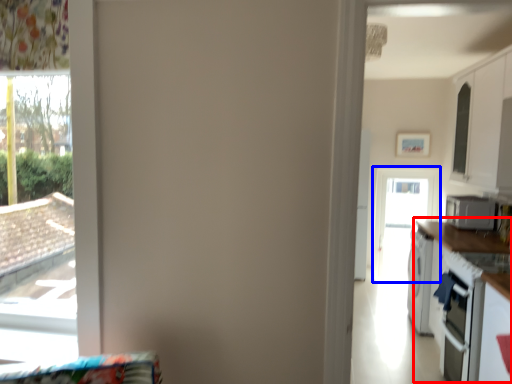
Question: Which object is closer to the camera taking this photo, counter top (highlighted by a red box) or screen door (highlighted by a blue box)?

Choices:
 (A) counter top
 (B) screen door

Answer: (A)